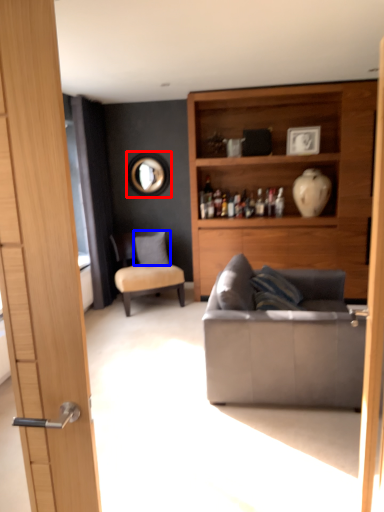
Question: Among these objects, which one is nearest to the camera, mirror (highlighted by a red box) or pillow (highlighted by a blue box)?

Choices:
 (A) mirror
 (B) pillow

Answer: (B)